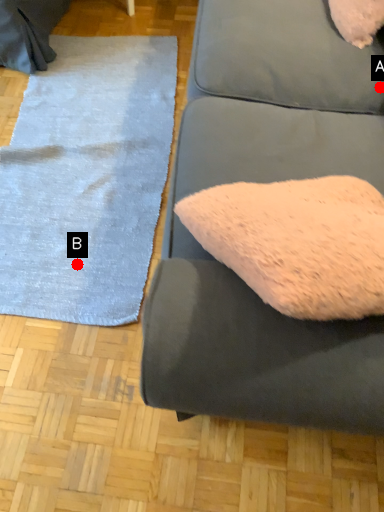
Question: Two points are circled on the image, labeled by A and B beside each circle. Which of the following is the farthest from the observer?

Choices:
 (A) A is further
 (B) B is further

Answer: (B)